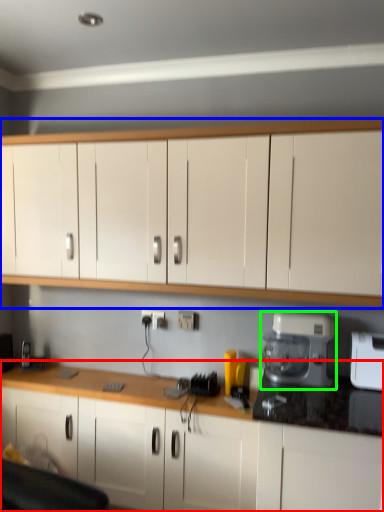
Question: Which object is positioned closest to cabinetry (highlighted by a red box)? Select from cabinetry (highlighted by a blue box) and home appliance (highlighted by a green box).

Choices:
 (A) cabinetry
 (B) home appliance

Answer: (B)